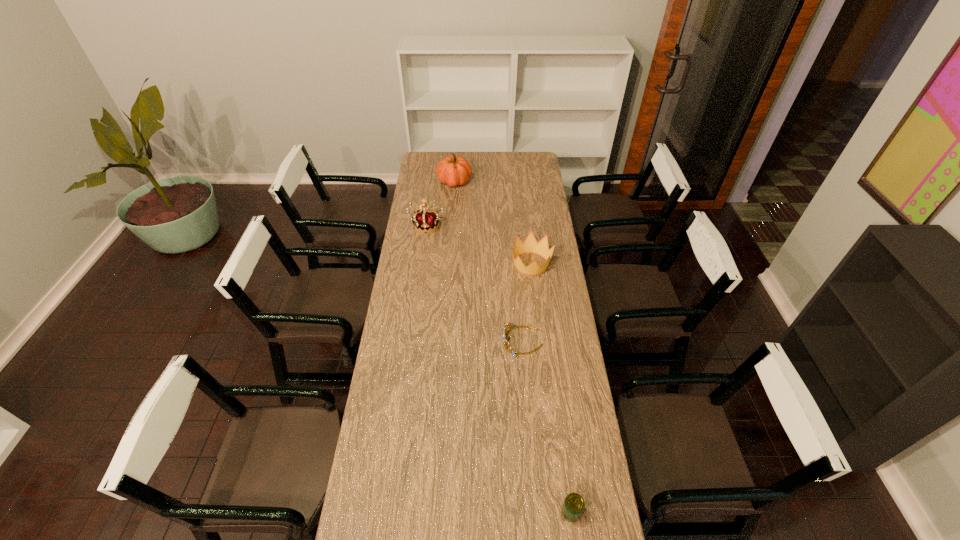
The width and height of the screenshot is (960, 540). In order to click on free spot between the third nearest object and the pumpkin in this screenshot , I will do `click(492, 223)`.

Image resolution: width=960 pixels, height=540 pixels. I want to click on vacant area between the beer can and the crown, so click(551, 388).

I want to click on free space that is in between the shorter tiara and the pumpkin, so click(x=489, y=261).

Where is `free point between the farthest object and the beer can`? This screenshot has height=540, width=960. free point between the farthest object and the beer can is located at coordinates (513, 347).

Where is `free space between the shorter tiara and the beer can`? free space between the shorter tiara and the beer can is located at coordinates (546, 427).

Locate an element on the screen. The height and width of the screenshot is (540, 960). free space between the pumpkin and the crown is located at coordinates (492, 223).

Locate which object ranks second in proximity to the left tiara. Please provide its 2D coordinates. Your answer should be formatted as a tuple, i.e. [(x, y)], where the tuple contains the x and y coordinates of a point satisfying the conditions above.

[(530, 245)]

The width and height of the screenshot is (960, 540). What are the coordinates of `object that can be found as the closest to the farthest object` in the screenshot? It's located at (425, 219).

Identify the location of vacant space that satisfies the following two spatial constraints: 1. on the front-facing side of the crown; 2. on the left side of the left tiara. (421, 264).

What are the coordinates of `free region that satisfies the following two spatial constraints: 1. on the front-facing side of the left tiara; 2. on the right side of the third shortest object` in the screenshot? It's located at (421, 264).